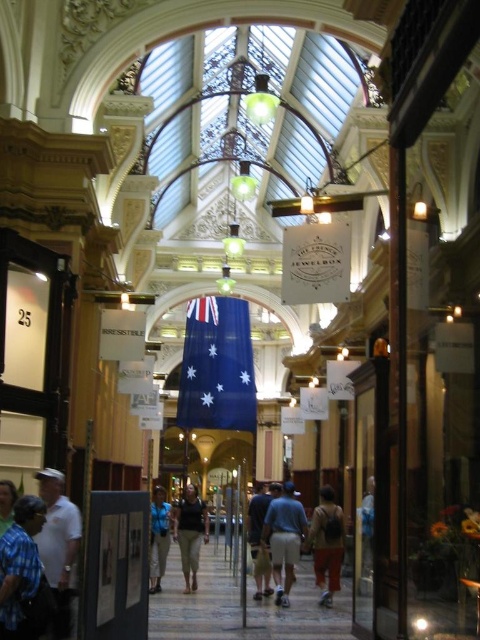
You are a customer in the arcade and want to choose between the orange fabric pants at center and the blue fabric at center. Which one is taller?

The orange fabric pants at center is taller than the blue fabric at center.

You are a customer in the arcade and want to find the jewelry store. You see a blue plaid shirt at lower left and denim pants at center. Which object is located higher in the image?

The blue plaid shirt at lower left is located above the denim pants at center, so it is higher in the image.